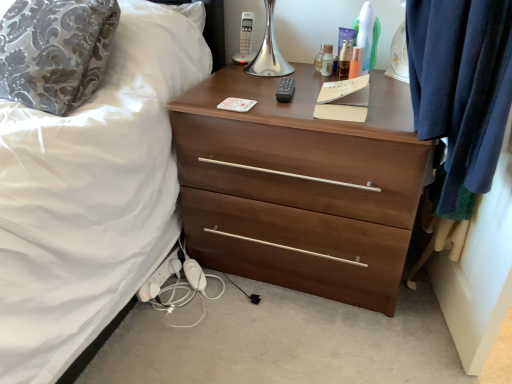
Looking at this image, in order to face translucent plastic bottles at upper right, the 3th toiletry in the left-to-right sequence, should I rotate leftwards or rightwards?

Rotate right and turn 12.015 degrees.

The height and width of the screenshot is (384, 512). Identify the location of black plastic remote at center. (286, 90).

Image resolution: width=512 pixels, height=384 pixels. Find the location of `clear plastic bottle at upper center, the third toiletry viewed from the right`. clear plastic bottle at upper center, the third toiletry viewed from the right is located at coordinates (327, 60).

The height and width of the screenshot is (384, 512). I want to click on clear plastic bottle at upper center, placed as the 4th toiletry when sorted from right to left, so click(319, 58).

This screenshot has height=384, width=512. What do you see at coordinates (319, 58) in the screenshot? I see `clear plastic bottle at upper center, placed as the 4th toiletry when sorted from right to left` at bounding box center [319, 58].

Describe the element at coordinates (160, 277) in the screenshot. The width and height of the screenshot is (512, 384). I see `white plastic extension cord at lower left` at that location.

At what (x,y) coordinates should I click in order to perform the action: click on brown wood chest of drawers at center. Please return your answer as a coordinate pair (x, y). Looking at the image, I should click on (300, 186).

Does translucent plastic bottle at upper center, the fourth toiletry from the left, turn towards translucent plastic bottles at upper right, which is the 2th toiletry in right-to-left order?

No, translucent plastic bottle at upper center, the fourth toiletry from the left, is not aimed at translucent plastic bottles at upper right, which is the 2th toiletry in right-to-left order.

Is point (360, 57) closer to viewer compared to point (347, 64)?

No, it is not.

How much distance is there between translucent plastic bottle at upper center, the fourth toiletry from the left, and translucent plastic bottles at upper right, which is the 2th toiletry in right-to-left order?

translucent plastic bottle at upper center, the fourth toiletry from the left, and translucent plastic bottles at upper right, which is the 2th toiletry in right-to-left order, are 0.99 inches apart.

Is translucent plastic bottle at upper center, the fourth toiletry from the left, bigger than translucent plastic bottles at upper right, the 3th toiletry in the left-to-right sequence?

No, translucent plastic bottle at upper center, the fourth toiletry from the left, is not bigger than translucent plastic bottles at upper right, the 3th toiletry in the left-to-right sequence.

Which object is closer to the camera taking this photo, translucent plastic bottle at upper center, the 1th toiletry positioned from the right, or brown wood chest of drawers at center?

brown wood chest of drawers at center.

From the image's perspective, is translucent plastic bottle at upper center, the 1th toiletry positioned from the right, above brown wood chest of drawers at center?

Yes.

From the picture: Between translucent plastic bottle at upper center, the 1th toiletry positioned from the right, and brown wood chest of drawers at center, which one has smaller width?

translucent plastic bottle at upper center, the 1th toiletry positioned from the right.

Could you measure the distance between translucent plastic bottle at upper center, the 1th toiletry positioned from the right, and brown wood chest of drawers at center?

A distance of 19.53 inches exists between translucent plastic bottle at upper center, the 1th toiletry positioned from the right, and brown wood chest of drawers at center.

Does silky damask pillow at upper left have a larger size compared to translucent plastic bottles at upper right, which is the 2th toiletry in right-to-left order?

Correct, silky damask pillow at upper left is larger in size than translucent plastic bottles at upper right, which is the 2th toiletry in right-to-left order.

Is silky damask pillow at upper left aimed at translucent plastic bottles at upper right, which is the 2th toiletry in right-to-left order?

No, silky damask pillow at upper left is not turned towards translucent plastic bottles at upper right, which is the 2th toiletry in right-to-left order.

Is point (36, 71) farther from viewer compared to point (342, 52)?

No, it is in front of (342, 52).

From the image's perspective, who appears lower, silky damask pillow at upper left or translucent plastic bottles at upper right, which is the 2th toiletry in right-to-left order?

silky damask pillow at upper left is shown below in the image.

Considering the relative sizes of silky damask pillow at upper left and black plastic remote at center in the image provided, is silky damask pillow at upper left bigger than black plastic remote at center?

Yes.

This screenshot has height=384, width=512. In order to click on remote control located underneath the silky damask pillow at upper left (from a real-world perspective) in this screenshot , I will do `click(286, 90)`.

From the picture: Is silky damask pillow at upper left directly adjacent to black plastic remote at center?

No, silky damask pillow at upper left is not making contact with black plastic remote at center.

Between black plastic remote at center and translucent plastic bottle at upper center, the 1th toiletry positioned from the right, which one is positioned behind?

translucent plastic bottle at upper center, the 1th toiletry positioned from the right, is further from the camera.

Does point (282, 79) appear closer or farther from the camera than point (355, 64)?

Clearly, point (282, 79) is more distant from the camera than point (355, 64).

Is translucent plastic bottle at upper center, the 1th toiletry positioned from the right, located within black plastic remote at center?

No, translucent plastic bottle at upper center, the 1th toiletry positioned from the right, is not surrounded by black plastic remote at center.

Can you confirm if silky damask pillow at upper left is positioned to the left of brown wood chest of drawers at center?

Indeed, silky damask pillow at upper left is positioned on the left side of brown wood chest of drawers at center.

Is point (6, 42) behind point (371, 108)?

Yes, point (6, 42) is behind point (371, 108).

Is silky damask pillow at upper left in front of or behind brown wood chest of drawers at center in the image?

Visually, silky damask pillow at upper left is located behind brown wood chest of drawers at center.

Considering the sizes of objects silky damask pillow at upper left and brown wood chest of drawers at center in the image provided, who is taller, silky damask pillow at upper left or brown wood chest of drawers at center?

Standing taller between the two is brown wood chest of drawers at center.

Find the location of a particular element. remote control to the right of white plastic extension cord at lower left is located at coordinates (286, 90).

Can you confirm if white plastic extension cord at lower left is taller than black plastic remote at center?

Yes, white plastic extension cord at lower left is taller than black plastic remote at center.

Is point (149, 295) closer or farther from the camera than point (285, 88)?

Point (149, 295) is positioned farther from the camera compared to point (285, 88).

From a real-world perspective, which object rests below the other?

white plastic extension cord at lower left, from a real-world perspective.

You are a GUI agent. You are given a task and a screenshot of the screen. Output one action in this format:
    pyautogui.click(x=<x>, y=<y>)
    Task: Click on the 1st toiletry behind the translucent plastic bottle at upper center, the 1th toiletry positioned from the right, counting from the anchor's position
    The height and width of the screenshot is (384, 512).
    Given the screenshot: What is the action you would take?
    pyautogui.click(x=344, y=59)

From a real-world perspective, count 3rd toiletrys upward from the brown wood chest of drawers at center and point to it. Please provide its 2D coordinates.

[(356, 63)]

Which object lies further to the anchor point silky damask pillow at upper left, black plastic remote at center or brown wood chest of drawers at center?

Among the two, black plastic remote at center is located further to silky damask pillow at upper left.

Based on their spatial positions, is clear plastic bottle at upper center, placed as the 4th toiletry when sorted from right to left, or black plastic remote at center further from translucent plastic bottles at upper right, the 3th toiletry in the left-to-right sequence?

Based on the image, black plastic remote at center appears to be further to translucent plastic bottles at upper right, the 3th toiletry in the left-to-right sequence.

Looking at the image, which one is located further to silky damask pillow at upper left, clear plastic bottle at upper center, placed as the 4th toiletry when sorted from right to left, or white plastic extension cord at lower left?

Based on the image, clear plastic bottle at upper center, placed as the 4th toiletry when sorted from right to left, appears to be further to silky damask pillow at upper left.

Which object lies further to the anchor point translucent plastic bottle at upper center, the fourth toiletry from the left, silky damask pillow at upper left or white plastic extension cord at lower left?

white plastic extension cord at lower left is further to translucent plastic bottle at upper center, the fourth toiletry from the left.

When comparing their distances from clear plastic bottle at upper center, placed as the 4th toiletry when sorted from right to left, does silky damask pillow at upper left or black plastic remote at center seem closer?

The object closer to clear plastic bottle at upper center, placed as the 4th toiletry when sorted from right to left, is black plastic remote at center.

When comparing their distances from translucent plastic bottle at upper center, the fourth toiletry from the left, does black plastic remote at center or translucent plastic bottles at upper right, which is the 2th toiletry in right-to-left order, seem closer?

translucent plastic bottles at upper right, which is the 2th toiletry in right-to-left order, is positioned closer to the anchor translucent plastic bottle at upper center, the fourth toiletry from the left.

Which object lies further to the anchor point white plastic extension cord at lower left, brown wood chest of drawers at center or black plastic remote at center?

black plastic remote at center is further to white plastic extension cord at lower left.

From the image, which object appears to be nearer to silky damask pillow at upper left, clear plastic bottle at upper center, positioned as the 1th toiletry in left-to-right order, or brown wood chest of drawers at center?

brown wood chest of drawers at center is positioned closer to the anchor silky damask pillow at upper left.

This screenshot has width=512, height=384. Identify the location of toiletry between clear plastic bottle at upper center, the third toiletry viewed from the right, and white plastic extension cord at lower left vertically. (356, 63).

Locate an element on the screen. chest of drawers between silky damask pillow at upper left and clear plastic bottle at upper center, which is counted as the 2th toiletry, starting from the left, from left to right is located at coordinates [x=300, y=186].

Locate an element on the screen. chest of drawers between silky damask pillow at upper left and translucent plastic bottles at upper right, the 3th toiletry in the left-to-right sequence, from left to right is located at coordinates (300, 186).

At what (x,y) coordinates should I click in order to perform the action: click on the chest of drawers located between silky damask pillow at upper left and translucent plastic bottle at upper center, the fourth toiletry from the left, in the left-right direction. Please return your answer as a coordinate pair (x, y). Looking at the image, I should click on (300, 186).